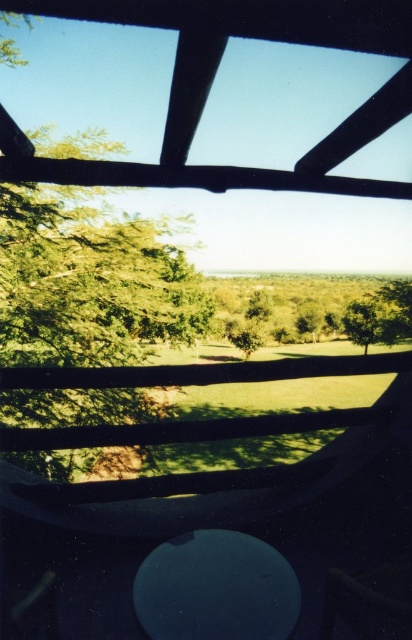
You are standing at the wooden structure in the scene. You see a point marked at coordinates [367,321]. What does this point represent?

The point at [367,321] represents the green leafy tree at center.

You are standing at the wooden structure in the foreground and want to walk towards the green leafy tree at left and the green leafy tree at center. Which tree will you encounter first?

The green leafy tree at left is positioned over the green leafy tree at center, so you will encounter the green leafy tree at center first because it is closer to you.